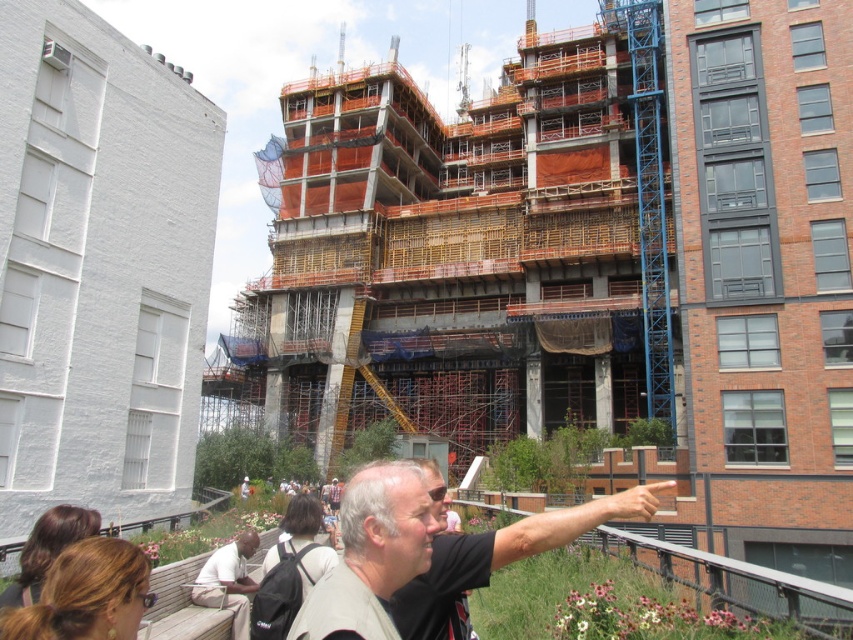
You are a construction worker standing at the base of the building. You see a gray fabric shirt at center. Where is the gray fabric shirt at center located relative to the point marked as point (x=496, y=560)?

The gray fabric shirt at center is located at point (x=496, y=560).

Looking at this image, you are standing at the construction site and see two points marked on the building facade. The first point is at coordinates point [354,544] and the second is at point [233,566]. Which point is closer to your current position?

Point [354,544] is closer to the camera than point [233,566], so the first point is closer to your current position.

You are standing at the construction site and want to take a photo of the partially completed building. You have a camera with a 50 foot minimum focusing distance. Is the light beige shirt at center within the camera range?

The light beige shirt at center and camera are 46.88 feet apart from each other, which is within the camera minimum focusing distance of 50 feet. Therefore, the camera can focus on the light beige shirt at center.